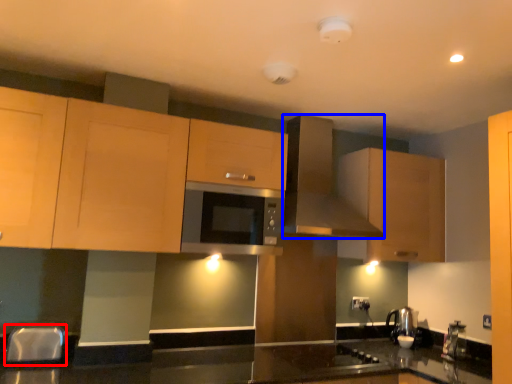
Question: Which of the following is the farthest to the observer, silver (highlighted by a red box) or kitchen appliance (highlighted by a blue box)?

Choices:
 (A) silver
 (B) kitchen appliance

Answer: (B)